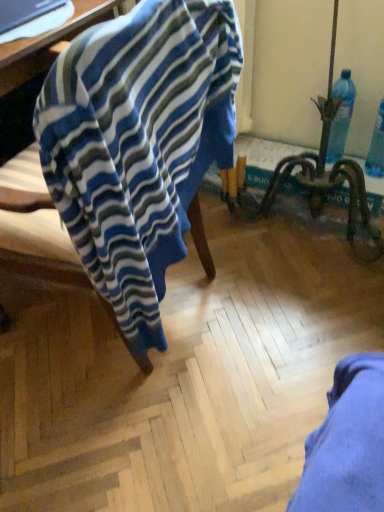
Measure the distance between point (50, 57) and camera.

They are 3.76 feet apart.

Where is `blue striped fabric at left`? Image resolution: width=384 pixels, height=512 pixels. blue striped fabric at left is located at coordinates (138, 145).

You are a GUI agent. You are given a task and a screenshot of the screen. Output one action in this format:
    pyautogui.click(x=<x>, y=<y>)
    Task: Click on the matte black laptop at upper left
    Image resolution: width=384 pixels, height=512 pixels.
    Given the screenshot: What is the action you would take?
    pyautogui.click(x=49, y=42)

Is matte black laptop at upper left at the back of blue striped fabric at left?

No.

Looking at their sizes, would you say blue striped fabric at left is wider or thinner than matte black laptop at upper left?

Clearly, blue striped fabric at left has less width compared to matte black laptop at upper left.

How many degrees apart are the facing directions of blue striped fabric at left and matte black laptop at upper left?

82.4 degrees separate the facing orientations of blue striped fabric at left and matte black laptop at upper left.

From the picture: Does blue striped fabric at left contain blue plastic bottle at upper right?

No, blue plastic bottle at upper right is not surrounded by blue striped fabric at left.

From the image's perspective, is blue striped fabric at left above or below blue plastic bottle at upper right?

blue striped fabric at left is situated lower than blue plastic bottle at upper right in the image.

Considering the relative sizes of blue striped fabric at left and blue plastic bottle at upper right in the image provided, is blue striped fabric at left smaller than blue plastic bottle at upper right?

No, blue striped fabric at left is not smaller than blue plastic bottle at upper right.

Which of these two, matte black laptop at upper left or blue striped fabric at left, is wider?

matte black laptop at upper left is wider.

I want to click on chair below the matte black laptop at upper left (from the image's perspective), so click(138, 145).

Is matte black laptop at upper left in contact with blue striped fabric at left?

matte black laptop at upper left is not next to blue striped fabric at left, and they're not touching.

Is matte black laptop at upper left wider than blue plastic bottle at upper right?

Yes, matte black laptop at upper left is wider than blue plastic bottle at upper right.

From a real-world perspective, is matte black laptop at upper left physically located above or below blue plastic bottle at upper right?

From a real-world perspective, matte black laptop at upper left is physically above blue plastic bottle at upper right.

Is matte black laptop at upper left turned away from blue plastic bottle at upper right?

matte black laptop at upper left is not turned away from blue plastic bottle at upper right.

From the image's perspective, is blue plastic bottle at upper right over blue striped fabric at left?

Yes.

Can you tell me how much blue plastic bottle at upper right and blue striped fabric at left differ in facing direction?

86.6 degrees separate the facing orientations of blue plastic bottle at upper right and blue striped fabric at left.

Does blue plastic bottle at upper right turn towards blue striped fabric at left?

No, blue plastic bottle at upper right is not oriented towards blue striped fabric at left.

Considering the relative sizes of blue plastic bottle at upper right and blue striped fabric at left in the image provided, is blue plastic bottle at upper right shorter than blue striped fabric at left?

Yes.

From a real-world perspective, relative to matte black laptop at upper left, is blue plastic bottle at upper right vertically above or below?

In terms of real-world spatial position, blue plastic bottle at upper right is below matte black laptop at upper left.

Is blue plastic bottle at upper right in front of or behind matte black laptop at upper left in the image?

Visually, blue plastic bottle at upper right is located behind matte black laptop at upper left.

Is blue plastic bottle at upper right to the left or to the right of matte black laptop at upper left in the image?

Based on their positions, blue plastic bottle at upper right is located to the right of matte black laptop at upper left.

What are the coordinates of `chair to the right of matte black laptop at upper left` in the screenshot? It's located at (138, 145).

The image size is (384, 512). I want to click on bottle above the blue striped fabric at left (from the image's perspective), so click(341, 116).

Looking at the image, which one is located further to blue plastic bottle at upper right, matte black laptop at upper left or blue striped fabric at left?

matte black laptop at upper left lies further to blue plastic bottle at upper right than the other object.

Based on their spatial positions, is blue striped fabric at left or matte black laptop at upper left further from blue plastic bottle at upper right?

matte black laptop at upper left.

When comparing their distances from matte black laptop at upper left, does blue plastic bottle at upper right or blue striped fabric at left seem closer?

Among the two, blue striped fabric at left is located nearer to matte black laptop at upper left.

Estimate the real-world distances between objects in this image. Which object is further from blue striped fabric at left, matte black laptop at upper left or blue plastic bottle at upper right?

Based on the image, blue plastic bottle at upper right appears to be further to blue striped fabric at left.

Based on their spatial positions, is blue plastic bottle at upper right or matte black laptop at upper left further from blue striped fabric at left?

blue plastic bottle at upper right is positioned further to the anchor blue striped fabric at left.

In the scene shown: Estimate the real-world distances between objects in this image. Which object is closer to matte black laptop at upper left, blue striped fabric at left or blue plastic bottle at upper right?

blue striped fabric at left.

The width and height of the screenshot is (384, 512). I want to click on chair between matte black laptop at upper left and blue plastic bottle at upper right, so click(x=138, y=145).